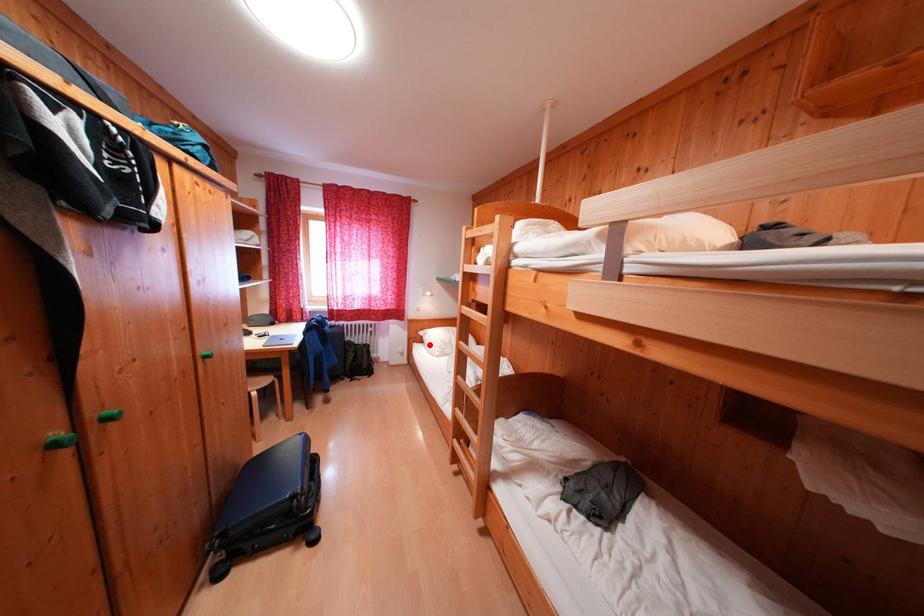
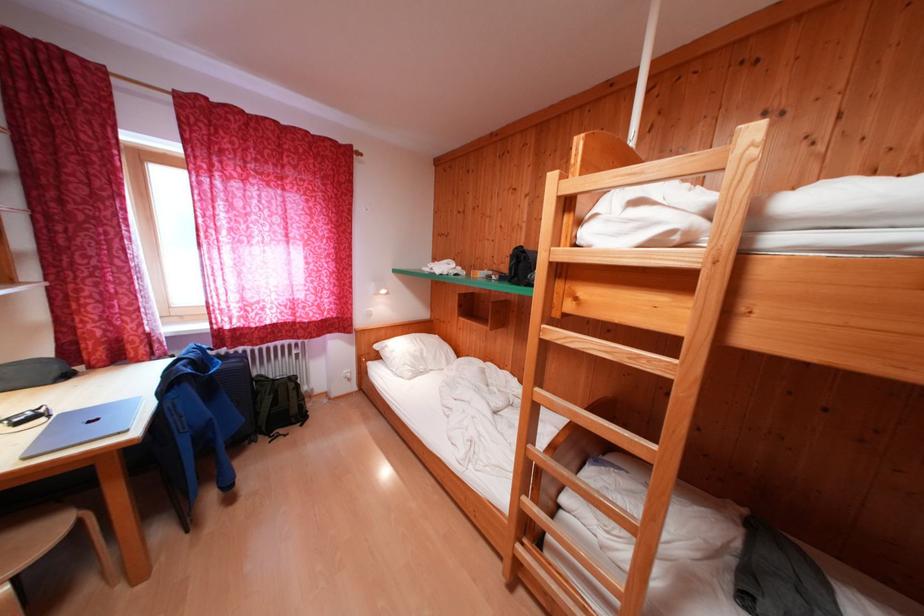
Where in the second image is the point corresponding to the highlighted location from the first image?

(385, 361)